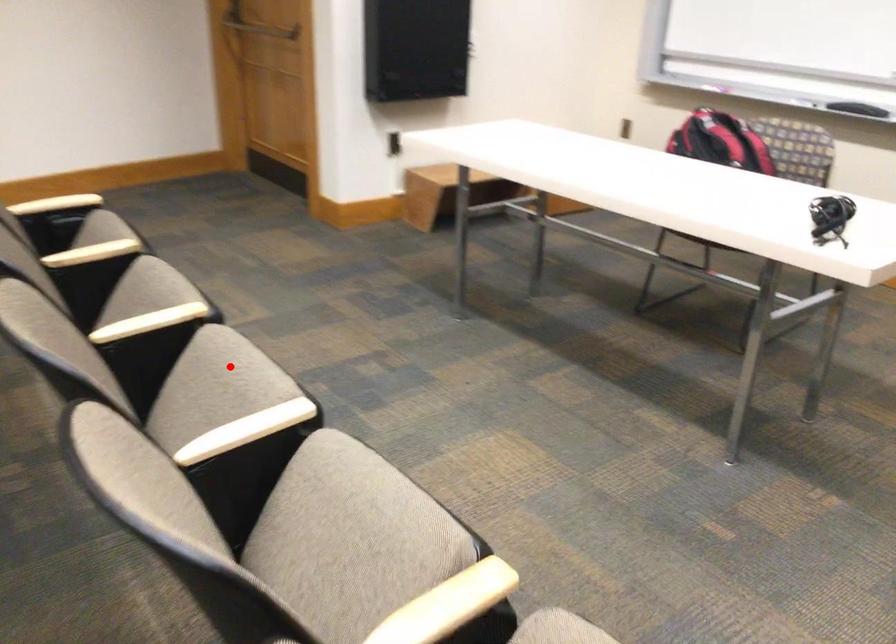
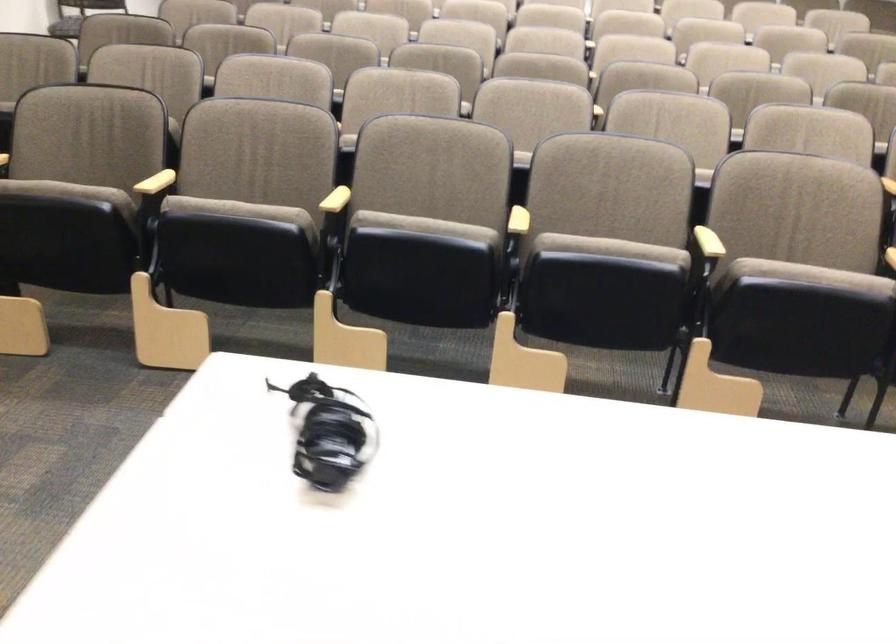
Question: I am providing you with two images of the same scene from different viewpoints. Image1 has a red point marked. In image2, the corresponding 3D location appears at what relative position? Reply with the corresponding letter.

Choices:
 (A) Closer
 (B) Farther

Answer: (B)